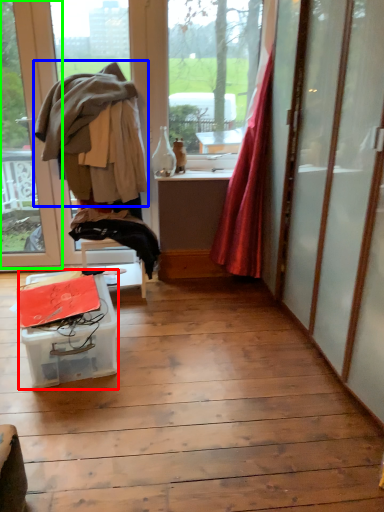
Question: Which object is the farthest from table (highlighted by a red box)? Choose among these: clothing (highlighted by a blue box) or window (highlighted by a green box).

Choices:
 (A) clothing
 (B) window

Answer: (B)